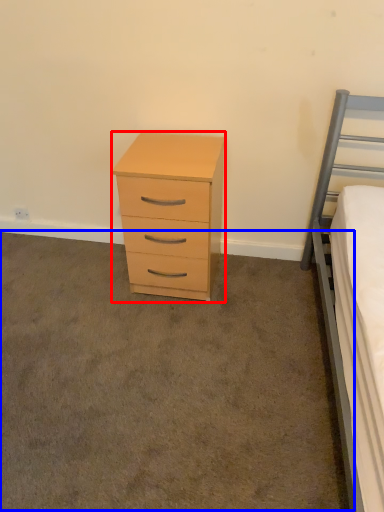
Question: Which object appears closest to the camera in this image, chest of drawers (highlighted by a red box) or plain (highlighted by a blue box)?

Choices:
 (A) chest of drawers
 (B) plain

Answer: (B)